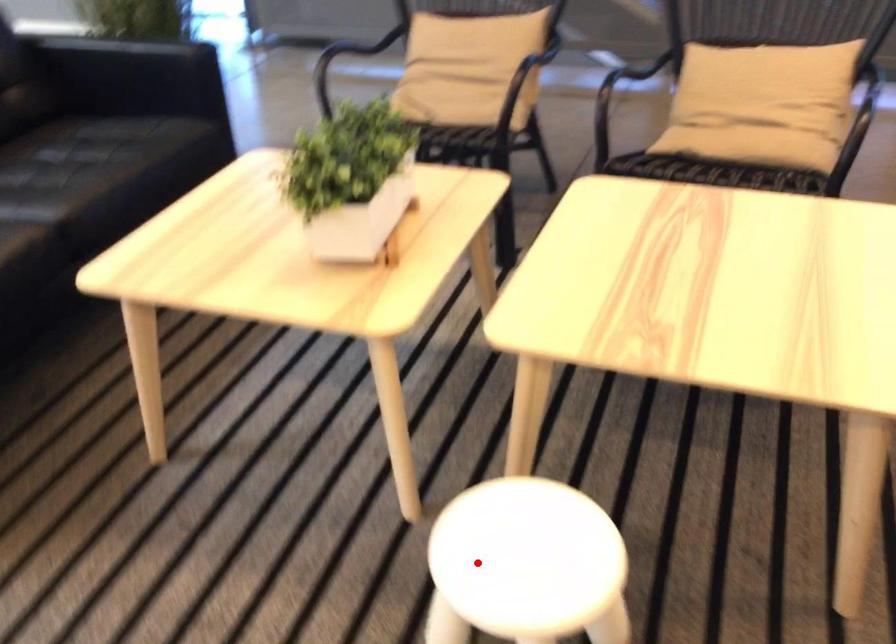
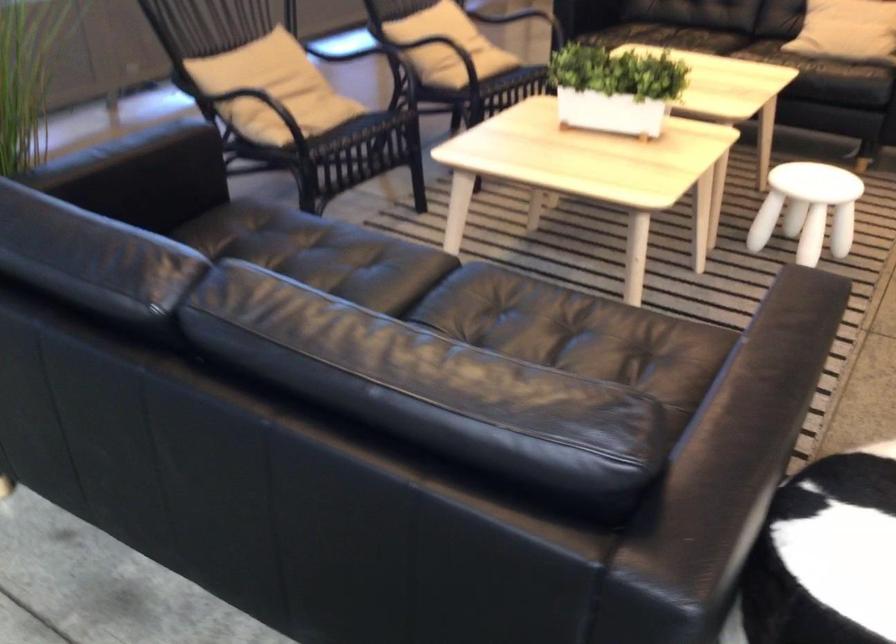
Question: I am providing you with two images of the same scene from different viewpoints. Image1 has a red point marked. In image2, the corresponding 3D location appears at what relative position? Reply with the corresponding letter.

Choices:
 (A) Closer
 (B) Farther

Answer: (B)